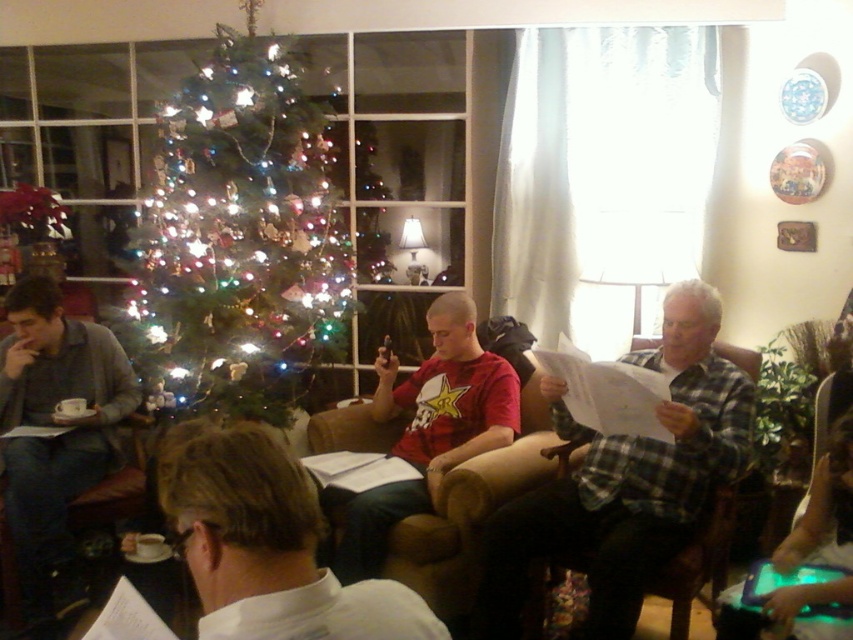
You are a photographer standing in the living room and want to take a photo that includes both the gray sweater at left and the red matte shirt at center. What is the minimum distance you need to move backward to ensure both are in frame?

The minimum distance you need to move backward is 39.21 inches to ensure both the gray sweater at left and the red matte shirt at center are in frame.

You are standing in the living room and want to place a gift under the Christmas tree. The gift requires placing at point coordinates between 0.5 and 0.7 on the x and y axes. Is the gray sweater at left positioned within this area?

The gray sweater at left is located at point coordinates of 0.664 on the x and 0.066 on the y. Since the required area is between 0.5 and 0.7 on both axes, the x coordinate is within range, but the y coordinate of 0.066 is below the minimum of 0.5. Therefore, the gray sweater at left is not within the desired placement area.